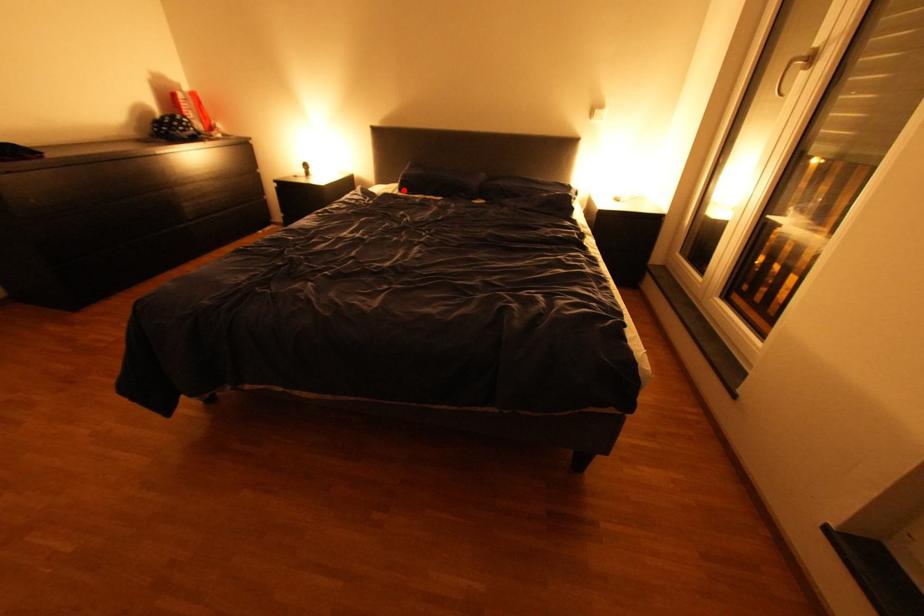
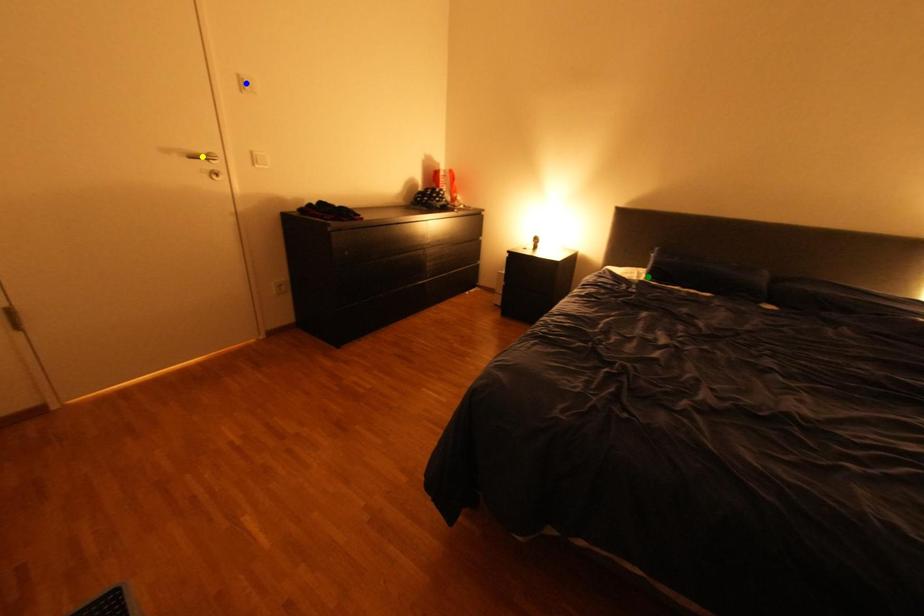
Question: I am providing you with two images of the same scene from different viewpoints. A red point is marked on the first image. You are given multiple points on the second image. Which point in image 2 represents the same 3d spot as the red point in image 1?

Choices:
 (A) green point
 (B) blue point
 (C) yellow point

Answer: (A)